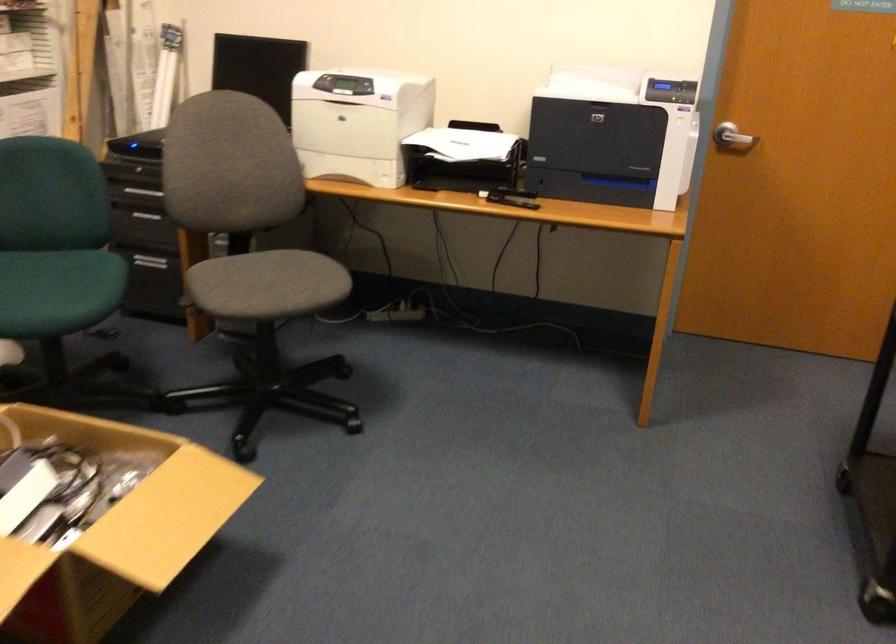
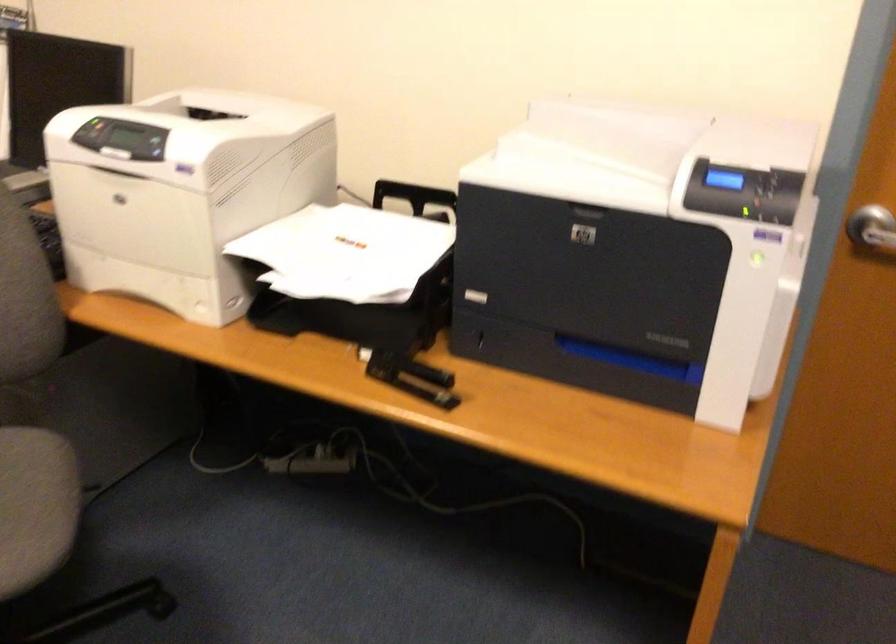
Question: What movement of the cameraman would produce the second image?

Choices:
 (A) Left
 (B) Right
 (C) Forward
 (D) Backward

Answer: (C)